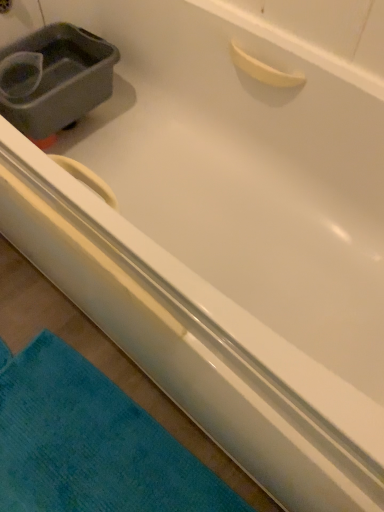
Find the location of a particular element. The width and height of the screenshot is (384, 512). teal soft towel at lower left is located at coordinates (90, 443).

Describe the element at coordinates (90, 443) in the screenshot. I see `teal soft towel at lower left` at that location.

What is the approximate height of gray plastic sink at upper left?

It is 6.66 inches.

Where is `gray plastic sink at upper left`? The image size is (384, 512). gray plastic sink at upper left is located at coordinates (54, 78).

What do you see at coordinates (54, 78) in the screenshot? The height and width of the screenshot is (512, 384). I see `gray plastic sink at upper left` at bounding box center [54, 78].

You are a GUI agent. You are given a task and a screenshot of the screen. Output one action in this format:
    pyautogui.click(x=<x>, y=<y>)
    Task: Click on the teal soft towel at lower left
    Image resolution: width=384 pixels, height=512 pixels.
    Given the screenshot: What is the action you would take?
    pyautogui.click(x=90, y=443)

Is gray plastic sink at upper left to the right of teal soft towel at lower left from the viewer's perspective?

Incorrect, gray plastic sink at upper left is not on the right side of teal soft towel at lower left.

Which object is more forward, gray plastic sink at upper left or teal soft towel at lower left?

Positioned in front is teal soft towel at lower left.

Does point (69, 58) appear closer or farther from the camera than point (39, 434)?

Point (69, 58) is farther from the camera than point (39, 434).

From the image's perspective, is gray plastic sink at upper left located beneath teal soft towel at lower left?

No, from the image's perspective, gray plastic sink at upper left is not below teal soft towel at lower left.

From a real-world perspective, is gray plastic sink at upper left below teal soft towel at lower left?

No.

Considering the relative sizes of gray plastic sink at upper left and teal soft towel at lower left in the image provided, is gray plastic sink at upper left wider than teal soft towel at lower left?

No, gray plastic sink at upper left is not wider than teal soft towel at lower left.

Consider the image. Who is taller, gray plastic sink at upper left or teal soft towel at lower left?

Standing taller between the two is gray plastic sink at upper left.

Considering the relative sizes of gray plastic sink at upper left and teal soft towel at lower left in the image provided, is gray plastic sink at upper left bigger than teal soft towel at lower left?

Indeed, gray plastic sink at upper left has a larger size compared to teal soft towel at lower left.

Consider the image. Is gray plastic sink at upper left located outside teal soft towel at lower left?

Yes, gray plastic sink at upper left is located beyond the bounds of teal soft towel at lower left.

Would you say gray plastic sink at upper left is a long distance from teal soft towel at lower left?

They are positioned close to each other.

Is gray plastic sink at upper left aimed at teal soft towel at lower left?

No, gray plastic sink at upper left is not turned towards teal soft towel at lower left.

The width and height of the screenshot is (384, 512). Find the location of `bath towel below the gray plastic sink at upper left (from the image's perspective)`. bath towel below the gray plastic sink at upper left (from the image's perspective) is located at coordinates (90, 443).

In the scene shown: Which object is positioned more to the left, teal soft towel at lower left or gray plastic sink at upper left?

gray plastic sink at upper left.

Relative to gray plastic sink at upper left, is teal soft towel at lower left in front or behind?

teal soft towel at lower left is in front of gray plastic sink at upper left.

Is point (119, 410) farther from viewer compared to point (61, 28)?

No, it is in front of (61, 28).

From the image's perspective, which one is positioned lower, teal soft towel at lower left or gray plastic sink at upper left?

teal soft towel at lower left, from the image's perspective.

From a real-world perspective, which object rests below the other?

From a 3D spatial view, teal soft towel at lower left is below.

Considering the relative sizes of teal soft towel at lower left and gray plastic sink at upper left in the image provided, is teal soft towel at lower left thinner than gray plastic sink at upper left?

No.

Considering the relative sizes of teal soft towel at lower left and gray plastic sink at upper left in the image provided, is teal soft towel at lower left shorter than gray plastic sink at upper left?

Yes.

Who is bigger, teal soft towel at lower left or gray plastic sink at upper left?

gray plastic sink at upper left is bigger.

Is gray plastic sink at upper left inside teal soft towel at lower left?

No, gray plastic sink at upper left is not a part of teal soft towel at lower left.

Is teal soft towel at lower left positioned far away from gray plastic sink at upper left?

No, teal soft towel at lower left is not far away from gray plastic sink at upper left.

Is teal soft towel at lower left facing towards gray plastic sink at upper left?

No, teal soft towel at lower left does not turn towards gray plastic sink at upper left.

In order to click on bath towel below the gray plastic sink at upper left (from the image's perspective) in this screenshot , I will do `click(90, 443)`.

Where is `bath towel on the right of the gray plastic sink at upper left`? bath towel on the right of the gray plastic sink at upper left is located at coordinates (90, 443).

The width and height of the screenshot is (384, 512). In order to click on sink lying behind the teal soft towel at lower left in this screenshot , I will do `click(54, 78)`.